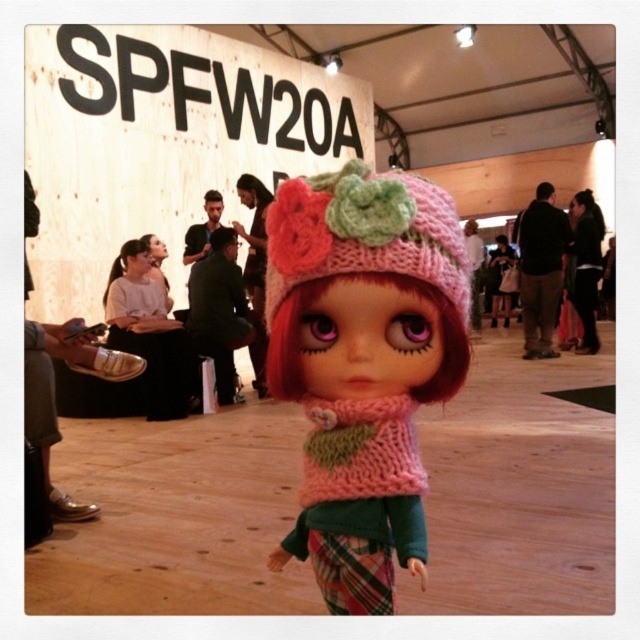
Question: Which point is closer to the camera taking this photo?

Choices:
 (A) (368, 436)
 (B) (289, 262)

Answer: (B)

Question: Which object appears farthest from the camera in this image?

Choices:
 (A) knitted pink hat at center
 (B) pink knitted hat at center

Answer: (A)

Question: In this image, where is knitted pink hat at center located relative to pink knitted hat at center?

Choices:
 (A) below
 (B) above

Answer: (A)

Question: Can you confirm if knitted pink hat at center is positioned above pink knitted hat at center?

Choices:
 (A) no
 (B) yes

Answer: (A)

Question: Can you confirm if knitted pink hat at center is smaller than pink knitted hat at center?

Choices:
 (A) yes
 (B) no

Answer: (B)